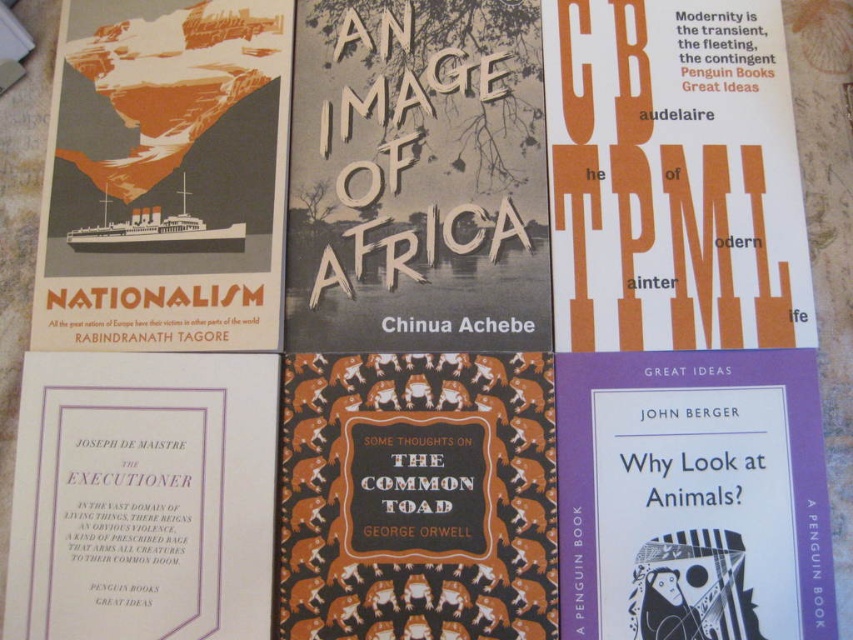
Question: Which object is the farthest from the matte orange poster at upper left?

Choices:
 (A) purple paperback book at bottom right
 (B) white paper at upper right
 (C) purple paper book at bottom left

Answer: (A)

Question: Which point appears farthest from the camera in this image?

Choices:
 (A) (202, 202)
 (B) (572, 426)

Answer: (A)

Question: Is matte orange poster at upper left below purple paper book at bottom left?

Choices:
 (A) no
 (B) yes

Answer: (A)

Question: Considering the relative positions of white paper at upper right and purple paper book at bottom left in the image provided, where is white paper at upper right located with respect to purple paper book at bottom left?

Choices:
 (A) above
 (B) below

Answer: (A)

Question: Is white paper at upper right in front of purple paper book at bottom left?

Choices:
 (A) yes
 (B) no

Answer: (B)

Question: Considering the real-world distances, which object is farthest from the white paper at upper right?

Choices:
 (A) brown textured paper at center
 (B) matte orange poster at upper left
 (C) purple paper book at bottom left

Answer: (C)